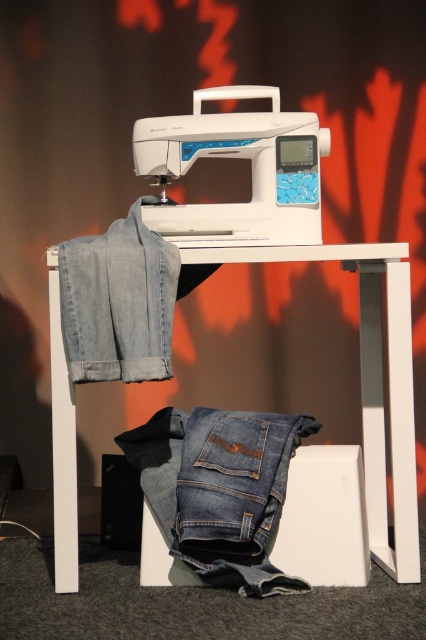
Question: Based on their relative distances, which object is farther from the white plastic table at center?

Choices:
 (A) denim at center
 (B) white plastic sewing machine at center

Answer: (A)

Question: Does white plastic table at center have a larger size compared to denim at center?

Choices:
 (A) yes
 (B) no

Answer: (A)

Question: Which point is farther from the camera taking this photo?

Choices:
 (A) (402, 333)
 (B) (184, 490)
 (C) (154, 125)

Answer: (C)

Question: Is white plastic table at center thinner than white plastic sewing machine at center?

Choices:
 (A) yes
 (B) no

Answer: (B)

Question: Does white plastic table at center appear on the left side of denim at center?

Choices:
 (A) yes
 (B) no

Answer: (B)

Question: Which of the following is the farthest from the observer?

Choices:
 (A) denim at center
 (B) white plastic sewing machine at center

Answer: (B)